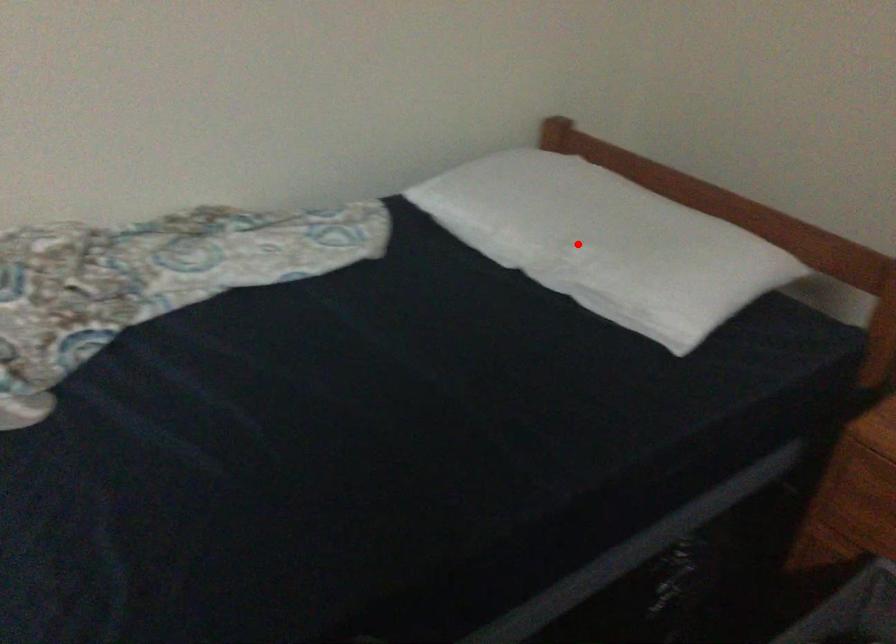
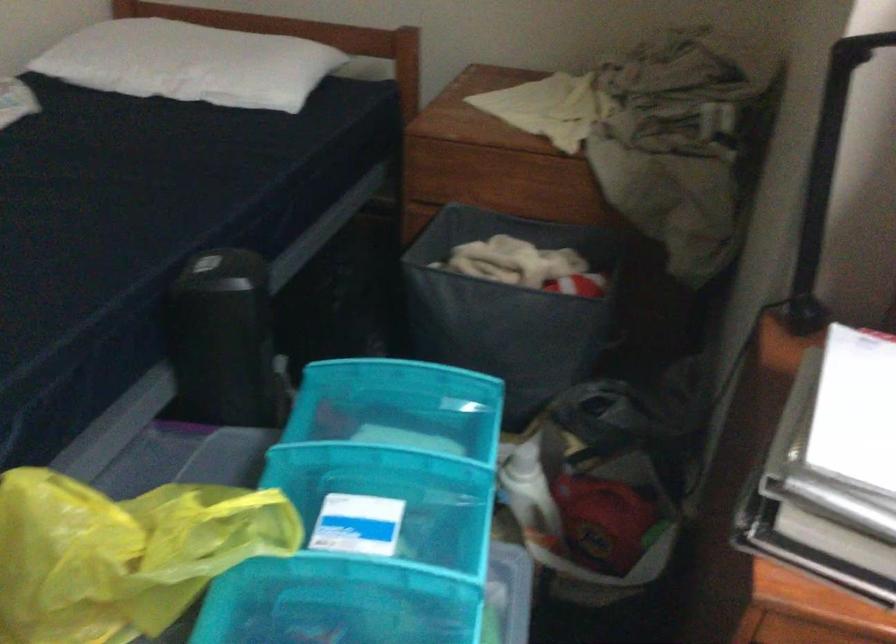
Question: I am providing you with two images of the same scene from different viewpoints. A red point is shown in image1. For the corresponding object point in image2, is it positioned nearer or farther from the camera?

Choices:
 (A) Nearer
 (B) Farther

Answer: (B)